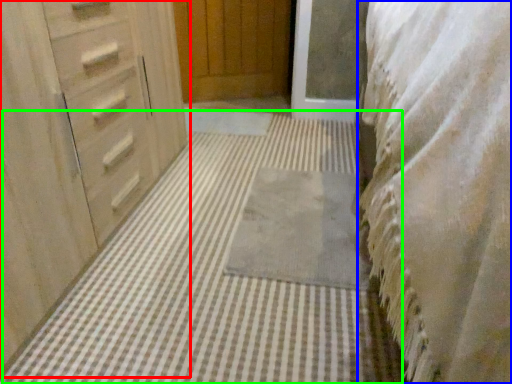
Question: Which object is positioned closest to chest of drawers (highlighted by a red box)? Select from bedding (highlighted by a blue box) and bath mat (highlighted by a green box).

Choices:
 (A) bedding
 (B) bath mat

Answer: (B)